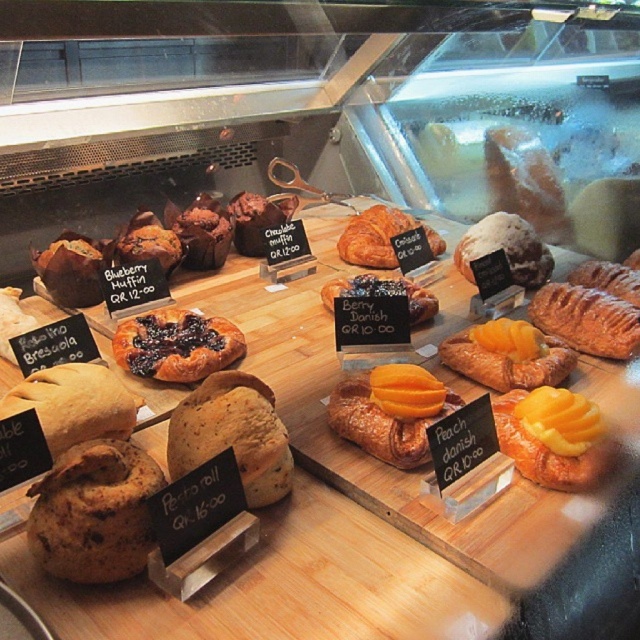
Which of these two, brown crumbly pastry at center-left or golden brown croissant at center, stands taller?

With more height is golden brown croissant at center.

Does brown crumbly pastry at center-left have a larger size compared to golden brown croissant at center?

Incorrect, brown crumbly pastry at center-left is not larger than golden brown croissant at center.

Does point (65, 513) come behind point (355, 220)?

That is False.

I want to click on brown crumbly pastry at center-left, so click(93, 513).

Is the position of yellow cream puff at center less distant than that of berry-colored danish at center?

Yes.

Is point (561, 461) positioned after point (348, 292)?

No, (561, 461) is closer to viewer.

Locate an element on the screen. The image size is (640, 640). yellow cream puff at center is located at coordinates (554, 436).

Is golden flaky croissant at center-right to the left of golden brown croissant at center from the viewer's perspective?

No, golden flaky croissant at center-right is not to the left of golden brown croissant at center.

Can you confirm if golden flaky croissant at center-right is positioned above golden brown croissant at center?

Actually, golden flaky croissant at center-right is below golden brown croissant at center.

Between point (568, 289) and point (374, 252), which one is positioned behind?

The point (374, 252) is behind.

You are a GUI agent. You are given a task and a screenshot of the screen. Output one action in this format:
    pyautogui.click(x=<x>, y=<y>)
    Task: Click on the golden flaky croissant at center-right
    The image size is (640, 640).
    Given the screenshot: What is the action you would take?
    pyautogui.click(x=586, y=320)